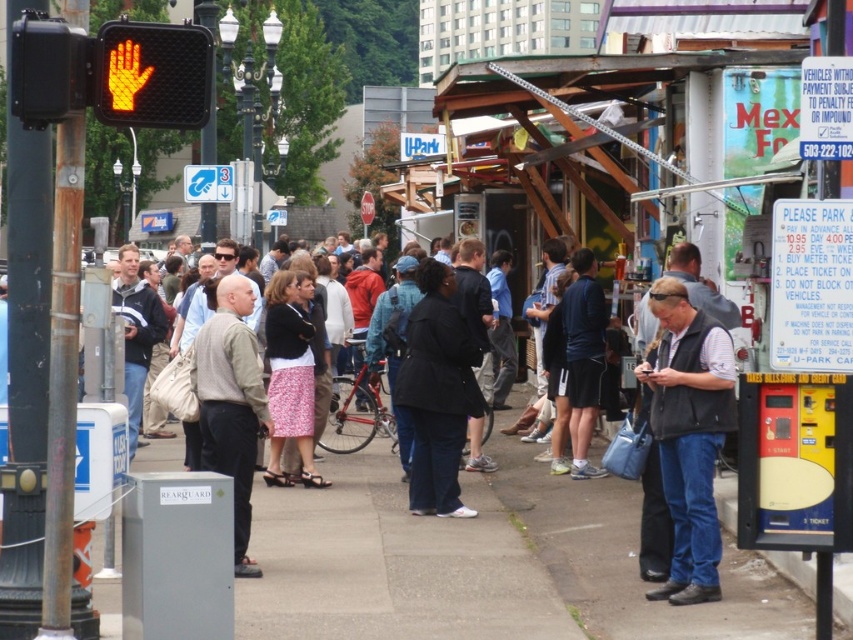
Based on the photo, you are a pedestrian waiting at the bus stop and see two people in the crowd wearing a dark gray vest at center and a light brown sweater at center. Which one is positioned higher in the image?

The light brown sweater at center is positioned higher in the image than the dark gray vest at center because the dark gray vest at center is located below it.

You are a pedestrian waiting at the bus stop and you see a person wearing a light brown sweater at center and another wearing a dark blue jersey at center. Which one is lower in position?

The light brown sweater at center is positioned under dark blue jersey at center, so the light brown sweater at center is lower in position.